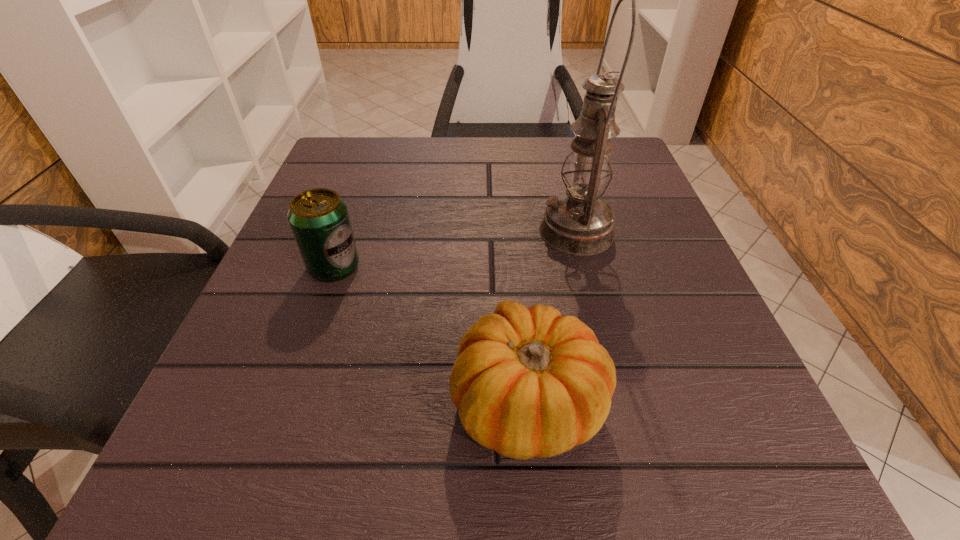
This screenshot has width=960, height=540. In the image, there is a desktop. What are the coordinates of `vacant space at the near edge` in the screenshot? It's located at (392, 491).

This screenshot has height=540, width=960. In the image, there is a desktop. What are the coordinates of `blank space at the left edge` in the screenshot? It's located at (370, 208).

In the image, there is a desktop. In order to click on free space at the right edge in this screenshot , I will do `click(600, 290)`.

Image resolution: width=960 pixels, height=540 pixels. In the image, there is a desktop. What are the coordinates of `free space at the far left corner` in the screenshot? It's located at (352, 146).

Where is `vacant space at the near left corner of the desktop`? The height and width of the screenshot is (540, 960). vacant space at the near left corner of the desktop is located at coordinates (298, 478).

This screenshot has height=540, width=960. Find the location of `vacant area that lies between the gourd and the leftmost object`. vacant area that lies between the gourd and the leftmost object is located at coordinates (431, 334).

Find the location of a particular element. free point between the beer can and the nearest object is located at coordinates (431, 334).

At what (x,y) coordinates should I click in order to perform the action: click on vacant region between the beer can and the tallest object. Please return your answer as a coordinate pair (x, y). Looking at the image, I should click on (455, 249).

Where is `free point between the beer can and the gourd`? free point between the beer can and the gourd is located at coordinates (431, 334).

The height and width of the screenshot is (540, 960). I want to click on vacant space that's between the tallest object and the leftmost object, so click(455, 249).